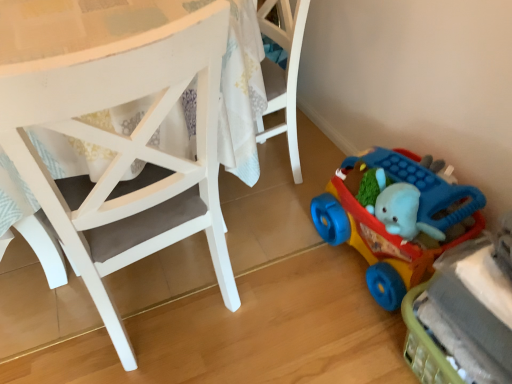
The image size is (512, 384). In order to click on white matte chair at center in this screenshot , I will do `click(116, 133)`.

Measure the distance between point (x=362, y=249) and camera.

They are 4.49 feet apart.

Where is `white matte chair at center`? white matte chair at center is located at coordinates (116, 133).

In terms of width, does white matte chair at center look wider or thinner when compared to rubberized plastic toy car at lower right, the first toy from the bottom?

In the image, white matte chair at center appears to be wider than rubberized plastic toy car at lower right, the first toy from the bottom.

From the image's perspective, is white matte chair at center above or below rubberized plastic toy car at lower right, the first toy from the bottom?

Clearly, from the image's perspective, white matte chair at center is above rubberized plastic toy car at lower right, the first toy from the bottom.

Does white matte chair at center turn towards rubberized plastic toy car at lower right, the first toy from the bottom?

No, white matte chair at center is not facing towards rubberized plastic toy car at lower right, the first toy from the bottom.

Considering the sizes of objects white matte chair at center and rubberized plastic toy car at lower right, arranged as the 2th toy when viewed from the top, in the image provided, who is bigger, white matte chair at center or rubberized plastic toy car at lower right, arranged as the 2th toy when viewed from the top,?

With larger size is white matte chair at center.

Consider the image. From the image's perspective, is rubberized plastic toy car at lower right, the first toy from the bottom, beneath rubberized plastic toy car at lower right, acting as the 2th toy starting from the bottom?

Yes, from the image's perspective, rubberized plastic toy car at lower right, the first toy from the bottom, is below rubberized plastic toy car at lower right, acting as the 2th toy starting from the bottom.

Which is closer, [453,262] or [383,171]?

Point [453,262].

From a real-world perspective, is rubberized plastic toy car at lower right, arranged as the 2th toy when viewed from the top, located higher than rubberized plastic toy car at lower right, the 1th toy from the top?

No, from a real-world perspective, rubberized plastic toy car at lower right, arranged as the 2th toy when viewed from the top, is not on top of rubberized plastic toy car at lower right, the 1th toy from the top.

Considering the relative sizes of rubberized plastic toy car at lower right, the first toy from the bottom, and rubberized plastic toy car at lower right, the 1th toy from the top, in the image provided, is rubberized plastic toy car at lower right, the first toy from the bottom, shorter than rubberized plastic toy car at lower right, the 1th toy from the top,?

Yes.

Considering the points (480, 349) and (9, 12), which point is behind, point (480, 349) or point (9, 12)?

The point (9, 12) is farther.

Who is smaller, rubberized plastic toy car at lower right, the first toy from the bottom, or white matte chair at center?

Smaller between the two is rubberized plastic toy car at lower right, the first toy from the bottom.

Which toy is the 1st one when counting from the back of the white matte chair at center? Please provide its 2D coordinates.

[(462, 318)]

Is rubberized plastic toy car at lower right, the first toy from the bottom, positioned with its back to white matte chair at center?

rubberized plastic toy car at lower right, the first toy from the bottom, does not have its back to white matte chair at center.

From a real-world perspective, who is located lower, rubberized plastic toy car at lower right, acting as the 2th toy starting from the bottom, or white matte chair at center?

From a 3D spatial view, rubberized plastic toy car at lower right, acting as the 2th toy starting from the bottom, is below.

Considering the sizes of rubberized plastic toy car at lower right, acting as the 2th toy starting from the bottom, and white matte chair at center in the image, is rubberized plastic toy car at lower right, acting as the 2th toy starting from the bottom, taller or shorter than white matte chair at center?

rubberized plastic toy car at lower right, acting as the 2th toy starting from the bottom, is shorter than white matte chair at center.

Could you measure the distance between rubberized plastic toy car at lower right, the 1th toy from the top, and white matte chair at center?

They are 21.26 inches apart.

Is rubberized plastic toy car at lower right, the 1th toy from the top, next to white matte chair at center and touching it?

No.

Choose the correct answer: Is rubberized plastic toy car at lower right, acting as the 2th toy starting from the bottom, inside rubberized plastic toy car at lower right, arranged as the 2th toy when viewed from the top, or outside it?

rubberized plastic toy car at lower right, acting as the 2th toy starting from the bottom, is spatially situated outside rubberized plastic toy car at lower right, arranged as the 2th toy when viewed from the top.

From the image's perspective, is rubberized plastic toy car at lower right, acting as the 2th toy starting from the bottom, positioned above or below rubberized plastic toy car at lower right, the first toy from the bottom?

rubberized plastic toy car at lower right, acting as the 2th toy starting from the bottom, is above rubberized plastic toy car at lower right, the first toy from the bottom.

Does rubberized plastic toy car at lower right, the 1th toy from the top, turn towards rubberized plastic toy car at lower right, the first toy from the bottom?

No.

Which is in front, rubberized plastic toy car at lower right, acting as the 2th toy starting from the bottom, or rubberized plastic toy car at lower right, the first toy from the bottom?

Positioned in front is rubberized plastic toy car at lower right, the first toy from the bottom.

Is white matte chair at center far from rubberized plastic toy car at lower right, acting as the 2th toy starting from the bottom?

white matte chair at center is actually quite close to rubberized plastic toy car at lower right, acting as the 2th toy starting from the bottom.

Is white matte chair at center inside or outside of rubberized plastic toy car at lower right, acting as the 2th toy starting from the bottom?

white matte chair at center exists outside the volume of rubberized plastic toy car at lower right, acting as the 2th toy starting from the bottom.

Who is bigger, white matte chair at center or rubberized plastic toy car at lower right, the 1th toy from the top?

A: white matte chair at center is bigger.

Is white matte chair at center at the right side of rubberized plastic toy car at lower right, the 1th toy from the top?

Incorrect, white matte chair at center is not on the right side of rubberized plastic toy car at lower right, the 1th toy from the top.

The height and width of the screenshot is (384, 512). I want to click on chair above the rubberized plastic toy car at lower right, arranged as the 2th toy when viewed from the top (from the image's perspective), so (x=116, y=133).

In order to click on toy above the rubberized plastic toy car at lower right, arranged as the 2th toy when viewed from the top (from a real-world perspective) in this screenshot , I will do (398, 220).

From the image, which object appears to be farther from rubberized plastic toy car at lower right, the 1th toy from the top, white matte chair at center or rubberized plastic toy car at lower right, the first toy from the bottom?

white matte chair at center is positioned further to the anchor rubberized plastic toy car at lower right, the 1th toy from the top.

Which object lies further to the anchor point rubberized plastic toy car at lower right, the 1th toy from the top, rubberized plastic toy car at lower right, the first toy from the bottom, or white matte chair at center?

Based on the image, white matte chair at center appears to be further to rubberized plastic toy car at lower right, the 1th toy from the top.

Based on their spatial positions, is white matte chair at center or rubberized plastic toy car at lower right, the 1th toy from the top, closer to rubberized plastic toy car at lower right, the first toy from the bottom?

rubberized plastic toy car at lower right, the 1th toy from the top, lies closer to rubberized plastic toy car at lower right, the first toy from the bottom, than the other object.

When comparing their distances from white matte chair at center, does rubberized plastic toy car at lower right, the 1th toy from the top, or rubberized plastic toy car at lower right, the first toy from the bottom, seem further?

Based on the image, rubberized plastic toy car at lower right, the first toy from the bottom, appears to be further to white matte chair at center.

When comparing their distances from rubberized plastic toy car at lower right, arranged as the 2th toy when viewed from the top, does rubberized plastic toy car at lower right, acting as the 2th toy starting from the bottom, or white matte chair at center seem further?

Among the two, white matte chair at center is located further to rubberized plastic toy car at lower right, arranged as the 2th toy when viewed from the top.

Based on their spatial positions, is rubberized plastic toy car at lower right, the first toy from the bottom, or rubberized plastic toy car at lower right, acting as the 2th toy starting from the bottom, closer to white matte chair at center?

Among the two, rubberized plastic toy car at lower right, acting as the 2th toy starting from the bottom, is located nearer to white matte chair at center.

At what (x,y) coordinates should I click in order to perform the action: click on toy between white matte chair at center and rubberized plastic toy car at lower right, arranged as the 2th toy when viewed from the top, in the horizontal direction. Please return your answer as a coordinate pair (x, y). This screenshot has height=384, width=512. Looking at the image, I should click on (398, 220).